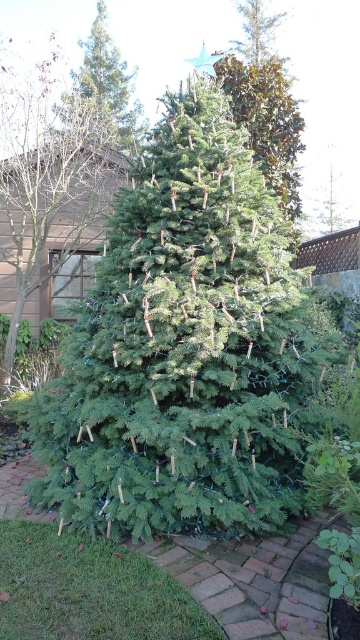
Is green matte christmas tree at center bigger than green matte tree at upper center?

Actually, green matte christmas tree at center might be smaller than green matte tree at upper center.

Does green matte christmas tree at center lie behind green matte tree at upper center?

No.

Does point (168, 400) lie behind point (135, 132)?

That is False.

You are a GUI agent. You are given a task and a screenshot of the screen. Output one action in this format:
    pyautogui.click(x=<x>, y=<y>)
    Task: Click on the green matte christmas tree at center
    
    Given the screenshot: What is the action you would take?
    click(186, 348)

Does green matte tree at center have a greater height compared to green matte tree at upper center?

Yes.

This screenshot has height=640, width=360. I want to click on green matte tree at center, so click(60, 166).

Between green matte christmas tree at center and green matte tree at center, which one is positioned lower?

Positioned lower is green matte christmas tree at center.

Is green matte christmas tree at center positioned behind green matte tree at center?

No.

The width and height of the screenshot is (360, 640). In order to click on green matte christmas tree at center in this screenshot , I will do pyautogui.click(x=186, y=348).